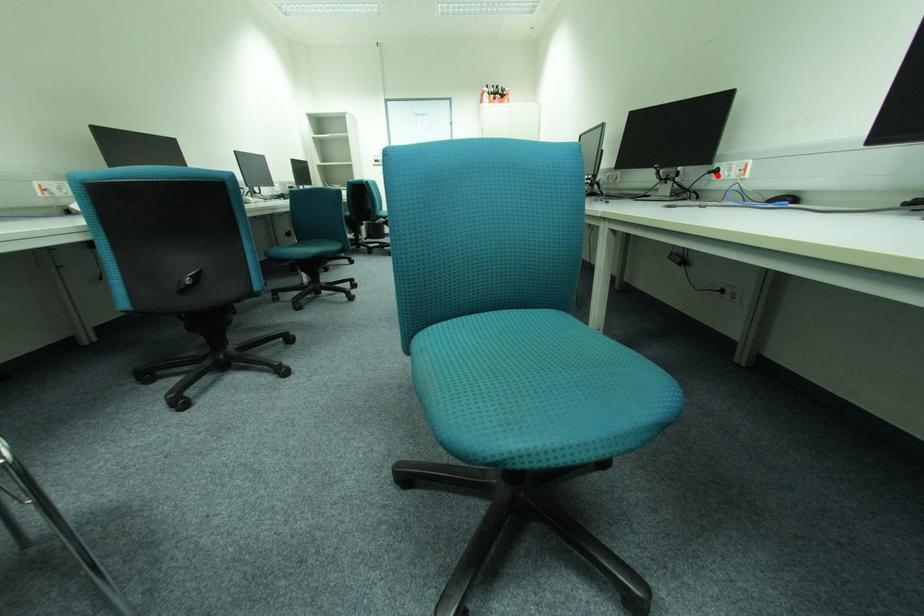
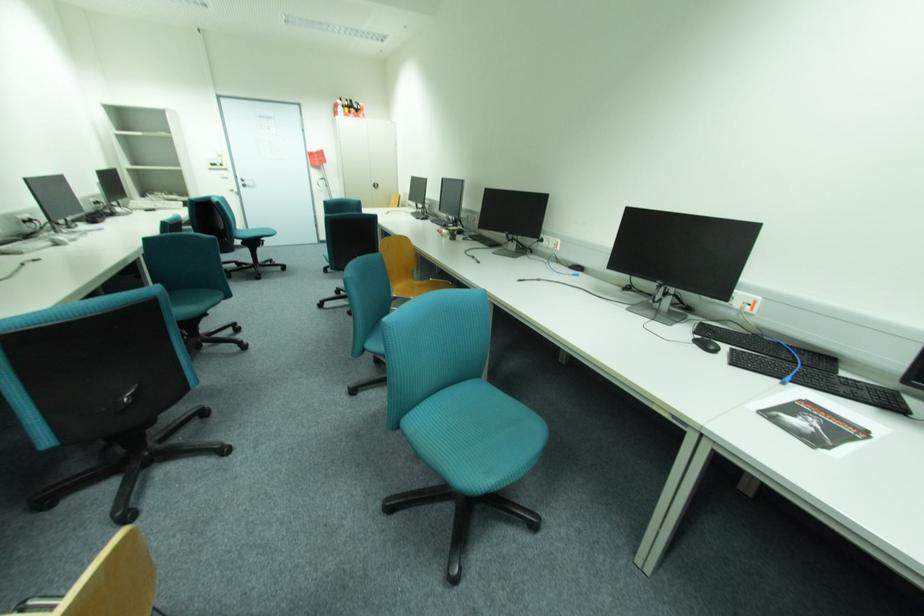
Question: I am providing you with two images of the same scene from different viewpoints. A red point is marked on the first image. Can you still see the location of the red point in image 2?

Choices:
 (A) Yes
 (B) No

Answer: (A)